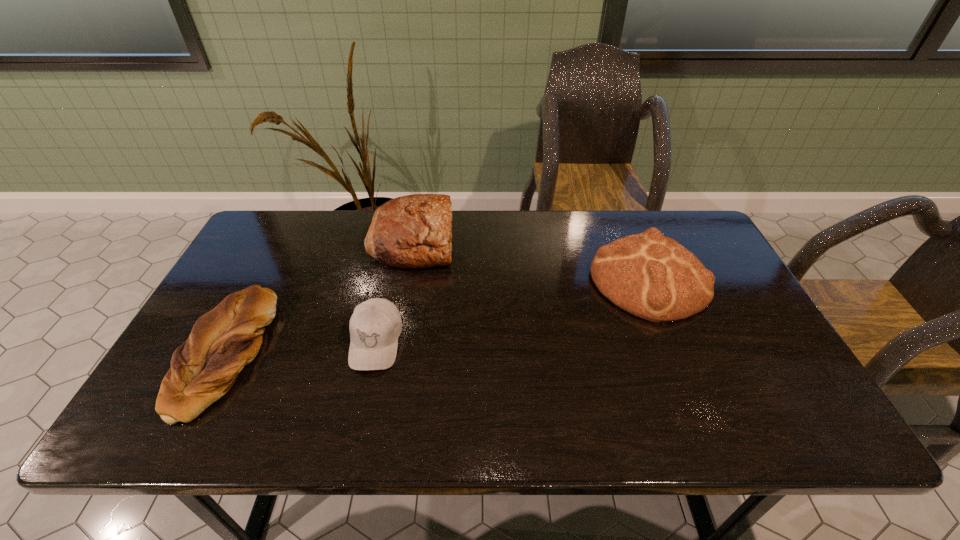
Find the location of a particular element. the second bread from right to left is located at coordinates (414, 231).

Locate an element on the screen. the tallest bread is located at coordinates tap(414, 231).

The width and height of the screenshot is (960, 540). What are the coordinates of `the second shortest bread` in the screenshot? It's located at (653, 277).

Find the location of a particular element. This screenshot has width=960, height=540. the second tallest object is located at coordinates (653, 277).

Locate an element on the screen. baseball cap is located at coordinates (375, 325).

You are a GUI agent. You are given a task and a screenshot of the screen. Output one action in this format:
    pyautogui.click(x=<x>, y=<y>)
    Task: Click on the shortest object
    
    Given the screenshot: What is the action you would take?
    pyautogui.click(x=224, y=340)

The height and width of the screenshot is (540, 960). I want to click on the shortest bread, so click(224, 340).

Where is `vacant area situated at the sliced front of the tallest bread`? This screenshot has width=960, height=540. vacant area situated at the sliced front of the tallest bread is located at coordinates (473, 240).

You are a GUI agent. You are given a task and a screenshot of the screen. Output one action in this format:
    pyautogui.click(x=<x>, y=<y>)
    Task: Click on the free spot located 0.280m on the front of the rightmost object
    
    Given the screenshot: What is the action you would take?
    pyautogui.click(x=708, y=424)

Locate an element on the screen. Image resolution: width=960 pixels, height=540 pixels. vacant area located on the front-facing side of the baseball cap is located at coordinates (361, 409).